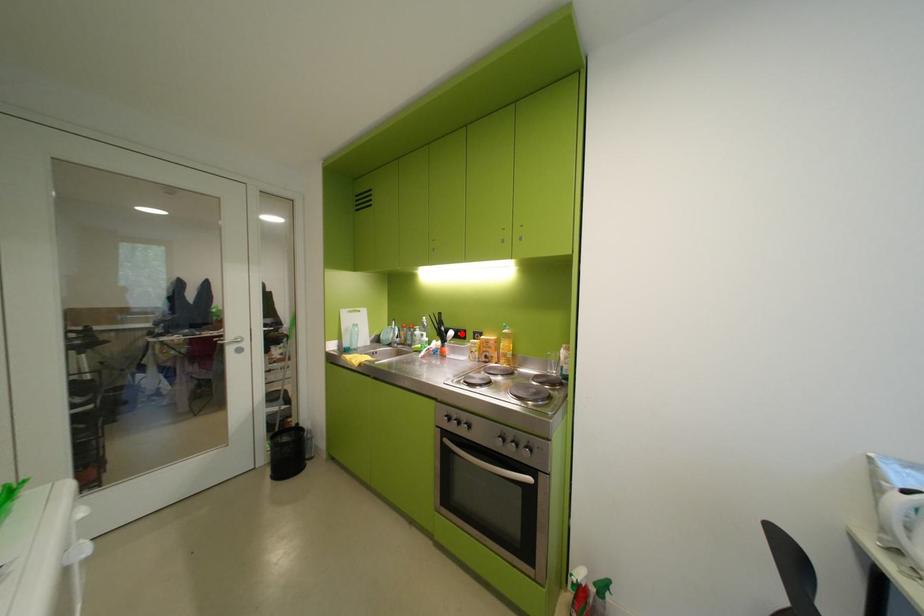
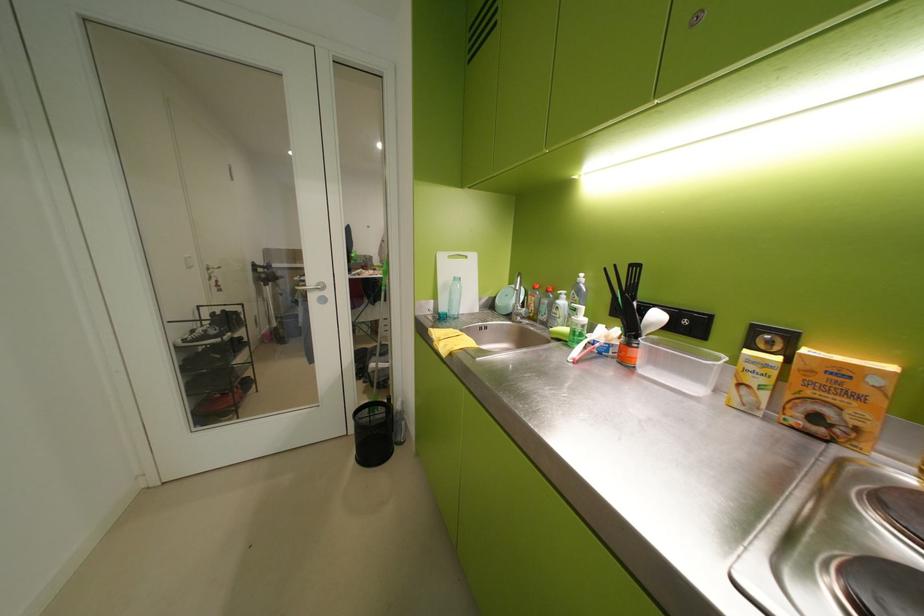
Find the pixel in the second image that matches the highlighted location in the first image.

(667, 317)